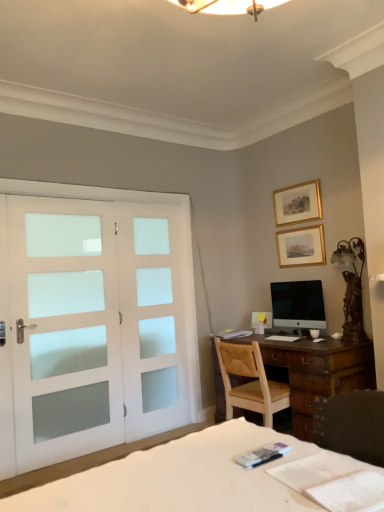
Question: From the image's perspective, is gold-framed picture at upper right, which appears as the 2th picture frame when viewed from the top, located beneath gold/gilded picture frame at upper center, which is the 2th picture frame in bottom-to-top order?

Choices:
 (A) no
 (B) yes

Answer: (B)

Question: From a real-world perspective, is gold-framed picture at upper right, which is the 1th picture frame in bottom-to-top order, physically below gold/gilded picture frame at upper center, positioned as the 1th picture frame in top-to-bottom order?

Choices:
 (A) yes
 (B) no

Answer: (A)

Question: Is gold-framed picture at upper right, which appears as the 2th picture frame when viewed from the top, facing towards gold/gilded picture frame at upper center, positioned as the 1th picture frame in top-to-bottom order?

Choices:
 (A) yes
 (B) no

Answer: (B)

Question: Considering the relative sizes of gold-framed picture at upper right, which appears as the 2th picture frame when viewed from the top, and gold/gilded picture frame at upper center, positioned as the 1th picture frame in top-to-bottom order, in the image provided, is gold-framed picture at upper right, which appears as the 2th picture frame when viewed from the top, thinner than gold/gilded picture frame at upper center, positioned as the 1th picture frame in top-to-bottom order,?

Choices:
 (A) no
 (B) yes

Answer: (B)

Question: Is gold-framed picture at upper right, which is the 1th picture frame in bottom-to-top order, closer to the viewer compared to gold/gilded picture frame at upper center, which is the 2th picture frame in bottom-to-top order?

Choices:
 (A) no
 (B) yes

Answer: (B)

Question: Is point (107, 467) closer or farther from the camera than point (349, 262)?

Choices:
 (A) farther
 (B) closer

Answer: (B)

Question: Based on their positions, is white fabric bed at lower left located to the left or right of bronze/metallic table lamp at right?

Choices:
 (A) left
 (B) right

Answer: (A)

Question: Considering the positions of white fabric bed at lower left and bronze/metallic table lamp at right in the image, is white fabric bed at lower left taller or shorter than bronze/metallic table lamp at right?

Choices:
 (A) tall
 (B) short

Answer: (B)

Question: In the image, is white fabric bed at lower left positioned in front of or behind bronze/metallic table lamp at right?

Choices:
 (A) front
 (B) behind

Answer: (A)

Question: From the image's perspective, is white frosted glass screen door at left positioned above or below white frosted glass doors at left?

Choices:
 (A) below
 (B) above

Answer: (A)

Question: Choose the correct answer: Is white frosted glass screen door at left inside white frosted glass doors at left or outside it?

Choices:
 (A) outside
 (B) inside

Answer: (A)

Question: In terms of size, does white frosted glass screen door at left appear bigger or smaller than white frosted glass doors at left?

Choices:
 (A) small
 (B) big

Answer: (A)

Question: In terms of height, does white frosted glass screen door at left look taller or shorter compared to white frosted glass doors at left?

Choices:
 (A) short
 (B) tall

Answer: (B)

Question: In the image, is black glossy monitor at center on the left side or the right side of bronze/metallic table lamp at right?

Choices:
 (A) right
 (B) left

Answer: (B)

Question: Is point (307, 300) closer or farther from the camera than point (344, 329)?

Choices:
 (A) farther
 (B) closer

Answer: (A)